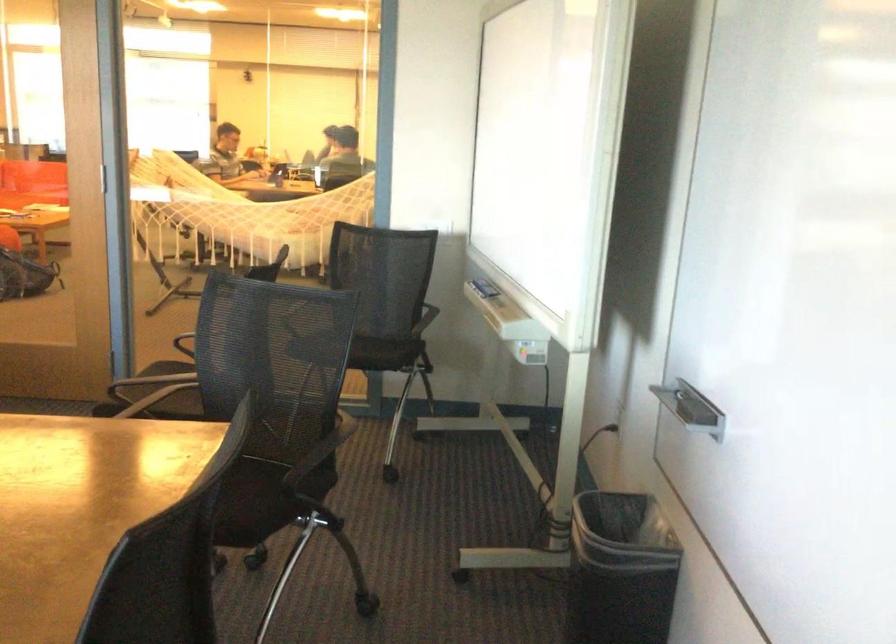
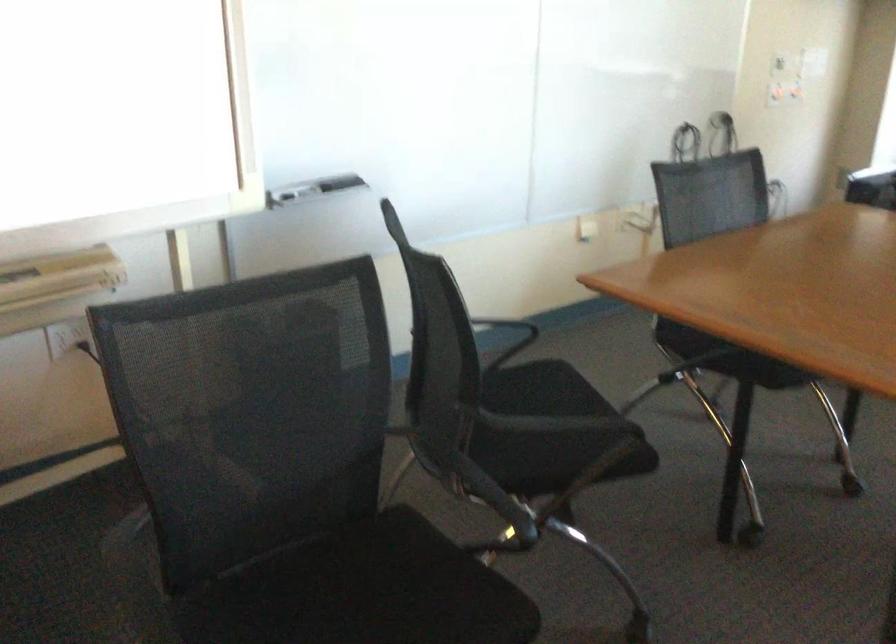
Where in the second image is the point corresponding to (702,404) from the first image?

(312, 189)